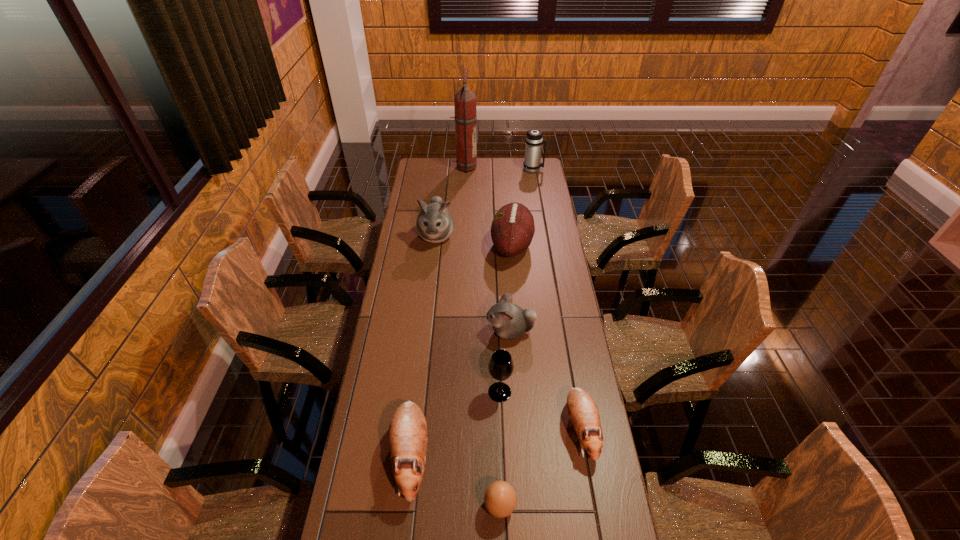
This screenshot has width=960, height=540. I want to click on the right brown hamster, so click(x=583, y=412).

Where is `the rightmost hamster`? the rightmost hamster is located at coordinates point(583,412).

This screenshot has height=540, width=960. Find the location of `brown boiled egg`. brown boiled egg is located at coordinates (500, 498).

Image resolution: width=960 pixels, height=540 pixels. In order to click on vacant space located on the side of the fire extinguisher with the label and nozzle in this screenshot , I will do `click(498, 167)`.

Where is `free region located on the face of the farther white hamster`? free region located on the face of the farther white hamster is located at coordinates (431, 279).

Locate an element on the screen. vacant region located 0.080m on the back of the brown football (American) is located at coordinates (509, 214).

At what (x,y) coordinates should I click in order to perform the action: click on blank area located on the left of the wineglass. Please return your answer as a coordinate pair (x, y). The height and width of the screenshot is (540, 960). Looking at the image, I should click on (443, 392).

Find the location of a particular element. This screenshot has width=960, height=540. vacant region located on the face of the nearer white hamster is located at coordinates (405, 332).

This screenshot has height=540, width=960. Find the location of `vacant space located 0.280m on the face of the nearer white hamster`. vacant space located 0.280m on the face of the nearer white hamster is located at coordinates (411, 332).

Identify the location of vacant space located on the face of the nearer white hamster. This screenshot has height=540, width=960. (405, 332).